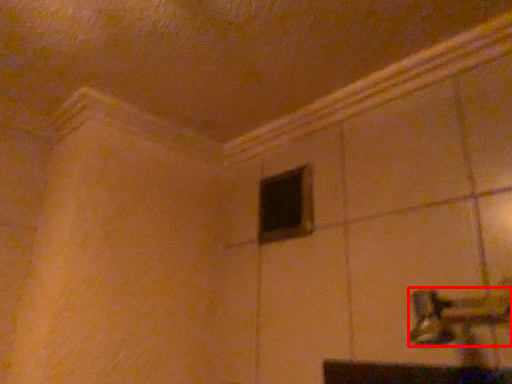
Question: Where is door handle (annotated by the red box) located in relation to window in the image?

Choices:
 (A) right
 (B) left

Answer: (A)